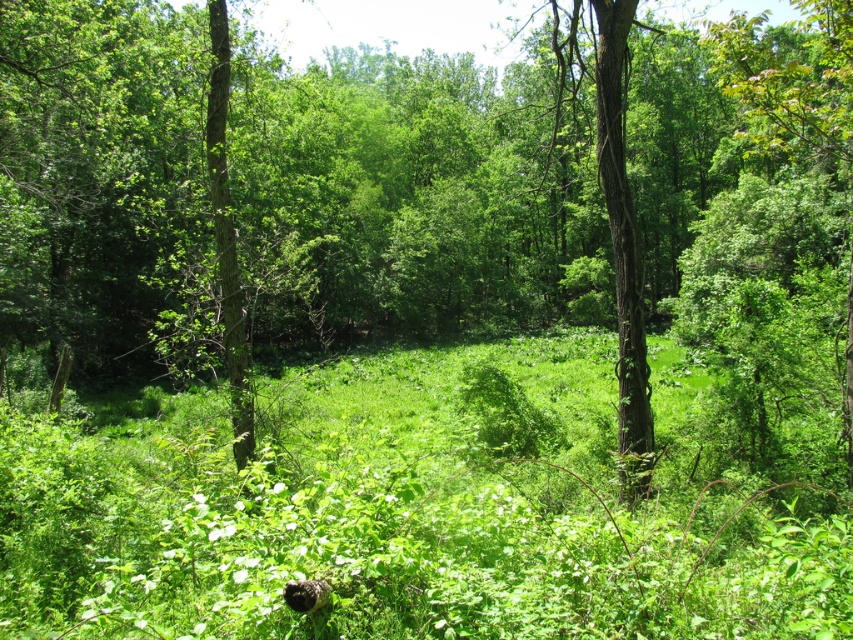
Question: Which of the following is the closest to the observer?

Choices:
 (A) green leafy grass at center
 (B) fluffy black cat at lower center

Answer: (A)

Question: Does green leafy grass at center have a smaller size compared to fluffy black cat at lower center?

Choices:
 (A) yes
 (B) no

Answer: (B)

Question: Which object appears farthest from the camera in this image?

Choices:
 (A) green leafy grass at center
 (B) fluffy black cat at lower center

Answer: (B)

Question: Which point is closer to the camera?

Choices:
 (A) (38, 636)
 (B) (318, 600)

Answer: (B)

Question: Does green leafy grass at center appear under fluffy black cat at lower center?

Choices:
 (A) yes
 (B) no

Answer: (A)

Question: Does green leafy grass at center appear on the right side of fluffy black cat at lower center?

Choices:
 (A) yes
 (B) no

Answer: (A)